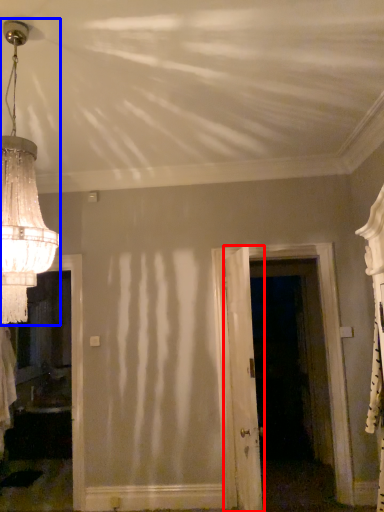
Question: Which point is further to the camera, door (highlighted by a red box) or lamp (highlighted by a blue box)?

Choices:
 (A) door
 (B) lamp

Answer: (A)